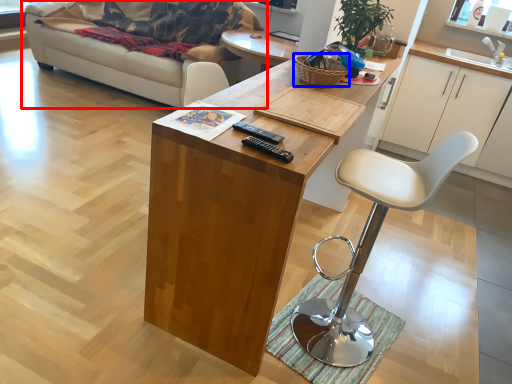
Question: Which object appears closest to the camera in this image, studio couch (highlighted by a red box) or basket (highlighted by a blue box)?

Choices:
 (A) studio couch
 (B) basket

Answer: (B)